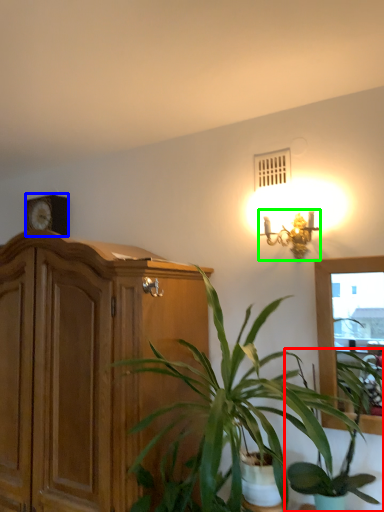
Question: Which is farther away from houseplant (highlighted by a red box)? clock (highlighted by a blue box) or lamp (highlighted by a green box)?

Choices:
 (A) clock
 (B) lamp

Answer: (A)